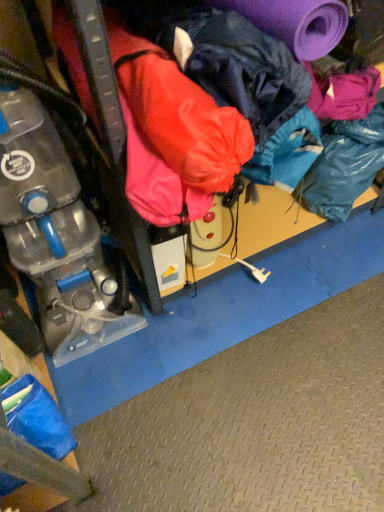
Describe the element at coordinates (58, 236) in the screenshot. I see `clear plastic bottle at left` at that location.

From the picture: Measure the distance between point (120, 334) and camera.

Point (120, 334) is 4.26 feet from camera.

The image size is (384, 512). What are the coordinates of `clear plastic bottle at left` in the screenshot? It's located at (58, 236).

Find the location of a particular element. This screenshot has width=384, height=512. clear plastic bottle at left is located at coordinates (58, 236).